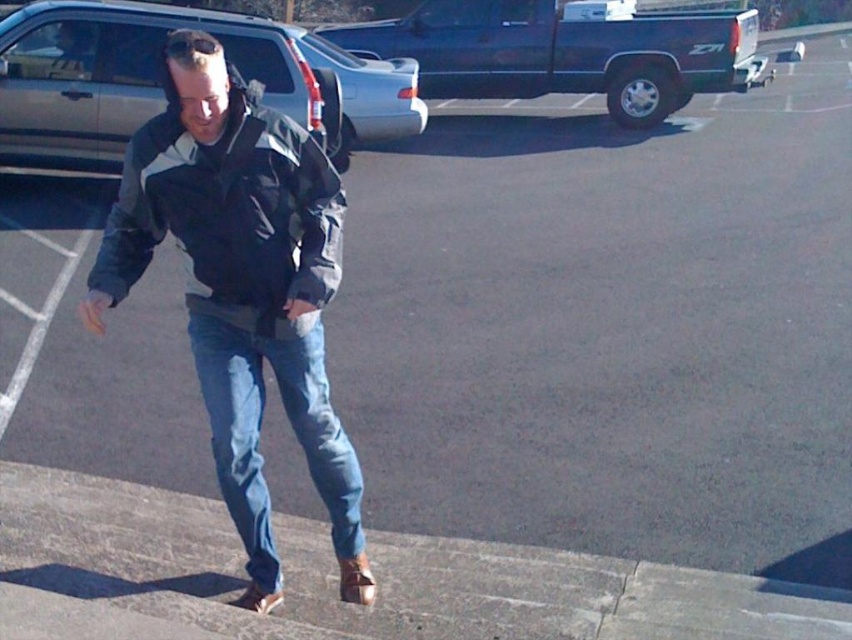
You are a drone operator trying to capture a closeup of the concrete at lower left. The drone is currently at a height of 10 feet above the ground. Can the drone descend to 5 feet to get a better shot?

The concrete at lower left is 10.85 feet from the camera. Since the drone is at 10 feet, it is already slightly below the required height for the shot. However, descending to 5 feet would bring it closer, but the distance from the camera would still depend on the drone moving forward. The question is about height, not distance. Since the drone can descend to 5 feet, it can get closer vertically, so yes, it can descend to 5 feet to get a better shot.

You are standing at the point marked by coordinates point (225, 208) in the parking lot. Looking around, you see a man wearing a dark jacket with lighter gray accents on the shoulders and sleeves. Where exactly is the dark gray white jacket located in relation to your current position?

The point (225, 208) marks the exact location of the dark gray white jacket at center, so you are currently standing right at the location of the dark gray white jacket.